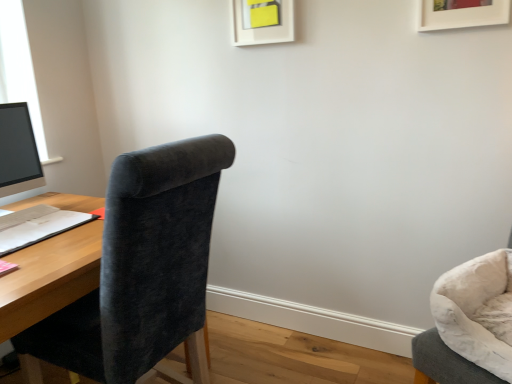
Question: Does matte black monitor at left have a smaller size compared to velvet grey chair at right, placed as the 1th chair when sorted from right to left?

Choices:
 (A) yes
 (B) no

Answer: (A)

Question: Would you say matte black monitor at left is a long distance from velvet grey chair at right, arranged as the 2th chair when viewed from the left?

Choices:
 (A) yes
 (B) no

Answer: (A)

Question: From the image's perspective, is matte black monitor at left below velvet grey chair at right, arranged as the 2th chair when viewed from the left?

Choices:
 (A) no
 (B) yes

Answer: (A)

Question: Is matte black monitor at left to the right of velvet grey chair at right, placed as the 1th chair when sorted from right to left, from the viewer's perspective?

Choices:
 (A) yes
 (B) no

Answer: (B)

Question: Is matte black monitor at left turned away from velvet grey chair at right, placed as the 1th chair when sorted from right to left?

Choices:
 (A) no
 (B) yes

Answer: (A)

Question: From a real-world perspective, relative to velvet dark gray chair at left, the first chair viewed from the left, is matte black monitor at left vertically above or below?

Choices:
 (A) below
 (B) above

Answer: (B)

Question: Considering the positions of point (10, 170) and point (120, 377), is point (10, 170) closer or farther from the camera than point (120, 377)?

Choices:
 (A) farther
 (B) closer

Answer: (A)

Question: Choose the correct answer: Is matte black monitor at left inside velvet dark gray chair at left, the second chair from the right, or outside it?

Choices:
 (A) inside
 (B) outside

Answer: (B)

Question: Looking at their shapes, would you say matte black monitor at left is wider or thinner than velvet dark gray chair at left, the first chair viewed from the left?

Choices:
 (A) wide
 (B) thin

Answer: (B)

Question: Looking at their shapes, would you say velvet dark gray chair at left, the second chair from the right, is wider or thinner than matte black monitor at left?

Choices:
 (A) wide
 (B) thin

Answer: (A)

Question: From a real-world perspective, is velvet dark gray chair at left, the second chair from the right, positioned above or below matte black monitor at left?

Choices:
 (A) below
 (B) above

Answer: (A)

Question: From the image's perspective, is velvet dark gray chair at left, the first chair viewed from the left, located above or below matte black monitor at left?

Choices:
 (A) above
 (B) below

Answer: (B)

Question: From their relative heights in the image, would you say velvet dark gray chair at left, the second chair from the right, is taller or shorter than matte black monitor at left?

Choices:
 (A) tall
 (B) short

Answer: (A)

Question: Is white paper at left spatially inside velvet grey chair at right, placed as the 1th chair when sorted from right to left, or outside of it?

Choices:
 (A) outside
 (B) inside

Answer: (A)

Question: In terms of width, does white paper at left look wider or thinner when compared to velvet grey chair at right, placed as the 1th chair when sorted from right to left?

Choices:
 (A) wide
 (B) thin

Answer: (B)